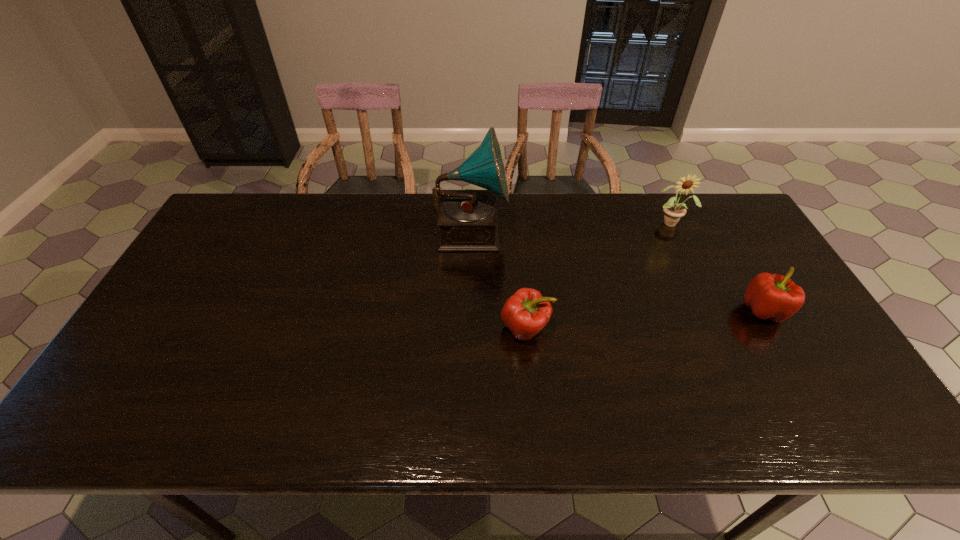
Where is `record player`? The image size is (960, 540). record player is located at coordinates (468, 219).

Find the location of a particular element. The height and width of the screenshot is (540, 960). the third object from left to right is located at coordinates (673, 211).

At what (x,y) coordinates should I click in order to perform the action: click on sunflower. Please return your answer as a coordinate pair (x, y). Looking at the image, I should click on (673, 211).

Locate an element on the screen. The width and height of the screenshot is (960, 540). the left bell pepper is located at coordinates (525, 313).

This screenshot has width=960, height=540. In order to click on the rightmost object in this screenshot , I will do `click(775, 297)`.

Locate an element on the screen. This screenshot has height=540, width=960. free space located on the horn of the record player is located at coordinates (528, 230).

This screenshot has height=540, width=960. In order to click on free point located 0.310m on the front-facing side of the second tallest object in this screenshot , I will do `click(710, 305)`.

Identify the location of free location located 0.120m on the right of the left bell pepper. (598, 328).

Locate an element on the screen. This screenshot has height=540, width=960. free space located on the front of the rightmost object is located at coordinates (831, 427).

Find the location of a particular element. The width and height of the screenshot is (960, 540). record player located in the far edge section of the desktop is located at coordinates (468, 219).